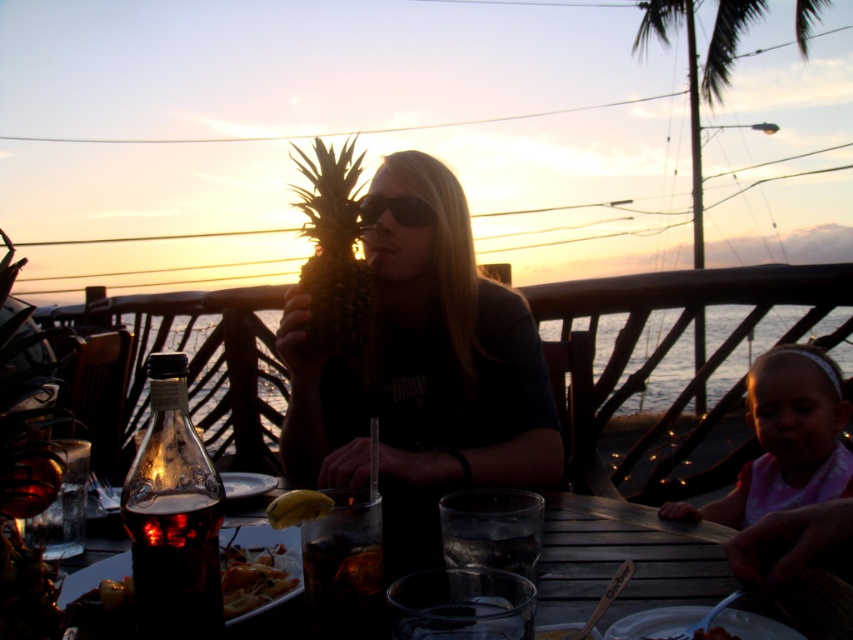
Question: In this image, where is transparent glass table at center located relative to pink fabric headband at lower right?

Choices:
 (A) left
 (B) right

Answer: (A)

Question: Among these points, which one is farthest from the camera?

Choices:
 (A) (735, 524)
 (B) (697, 404)
 (C) (364, 218)

Answer: (B)

Question: Which object appears farthest from the camera in this image?

Choices:
 (A) pink fabric headband at lower right
 (B) green leafy palm tree at upper right
 (C) black plastic sunglasses at center

Answer: (B)

Question: In this image, where is transparent glass table at center located relative to black plastic sunglasses at center?

Choices:
 (A) left
 (B) right

Answer: (B)

Question: Can you confirm if transparent glass table at center is positioned to the right of black plastic sunglasses at center?

Choices:
 (A) no
 (B) yes

Answer: (B)

Question: Which object appears closest to the camera in this image?

Choices:
 (A) black plastic sunglasses at center
 (B) green leafy palm tree at upper right

Answer: (A)